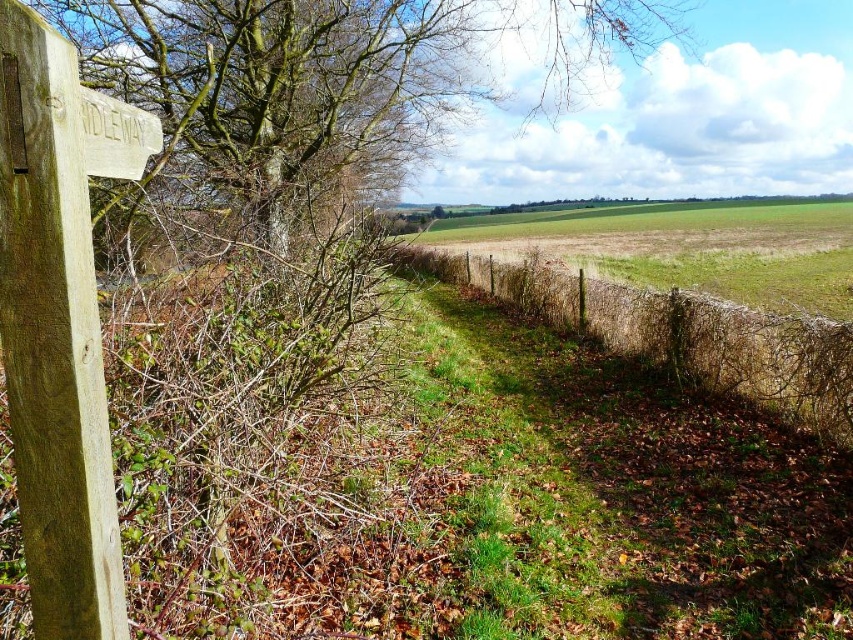
Question: Among these points, which one is nearest to the camera?

Choices:
 (A) (473, 67)
 (B) (0, 26)

Answer: (B)

Question: Considering the relative positions of brown bark tree at upper left and wooden signpost at left in the image provided, where is brown bark tree at upper left located with respect to wooden signpost at left?

Choices:
 (A) left
 (B) right

Answer: (B)

Question: Is brown bark tree at upper left smaller than wooden signpost at left?

Choices:
 (A) yes
 (B) no

Answer: (B)

Question: Does brown bark tree at upper left appear over wooden signpost at left?

Choices:
 (A) yes
 (B) no

Answer: (A)